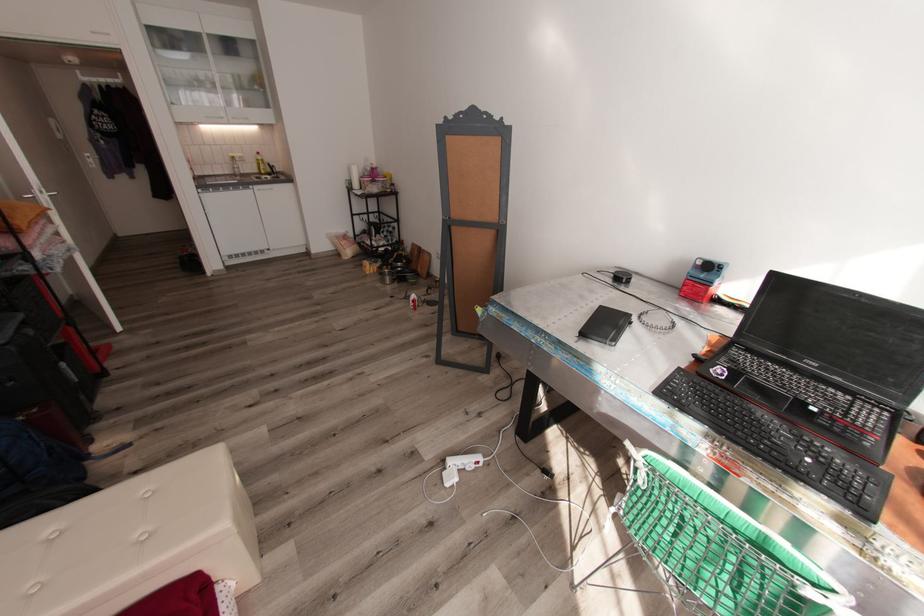
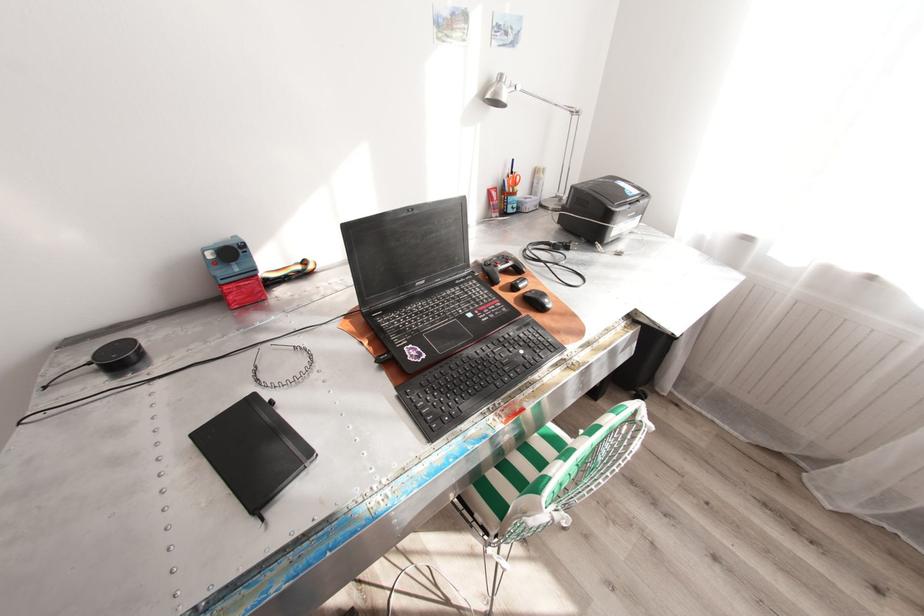
Locate, in the second image, the point that corresponds to pixel 714 286 in the first image.

(261, 275)